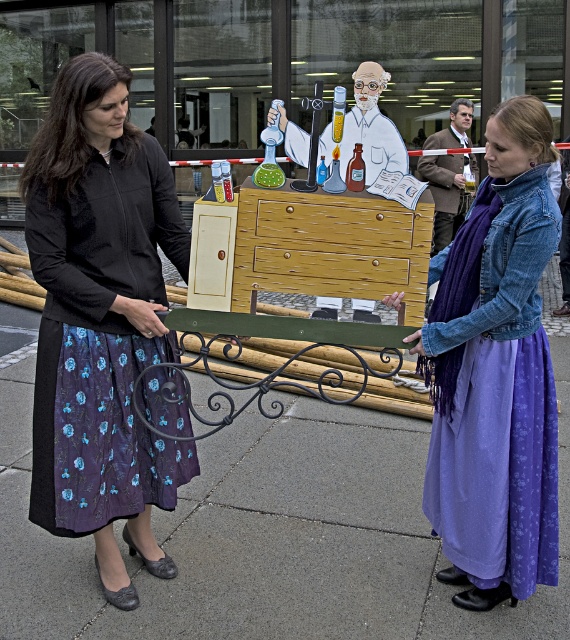
Can you confirm if velvet black blouse at left is taller than brown leather jacket at center?

Correct, velvet black blouse at left is much taller as brown leather jacket at center.

Is velvet black blouse at left wider than brown leather jacket at center?

In fact, velvet black blouse at left might be narrower than brown leather jacket at center.

This screenshot has width=570, height=640. Find the location of `velvet black blouse at left`. velvet black blouse at left is located at coordinates (100, 320).

Which is behind, point (80, 60) or point (486, 358)?

Positioned behind is point (486, 358).

Consider the image. Between velvet black blouse at left and purple cotton skirt at lower right, which one appears on the left side from the viewer's perspective?

velvet black blouse at left

Who is more distant from viewer, (76, 81) or (532, 512)?

The point (532, 512) is behind.

This screenshot has height=640, width=570. Identify the location of velvet black blouse at left. (100, 320).

Does concrete pavement at center have a greater height compared to purple cotton skirt at lower right?

No.

Is concrete pavement at center above purple cotton skirt at lower right?

No.

What do you see at coordinates (270, 536) in the screenshot? I see `concrete pavement at center` at bounding box center [270, 536].

In order to click on concrete pavement at center in this screenshot , I will do `click(270, 536)`.